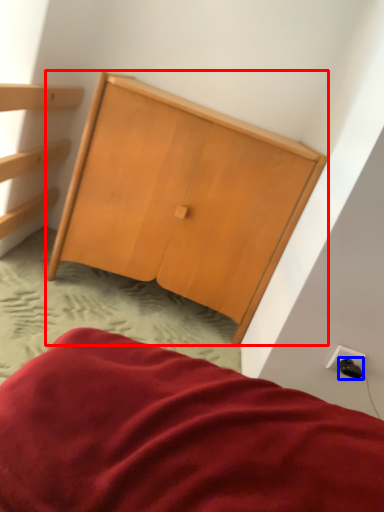
Question: Which object appears farthest to the camera in this image, furniture (highlighted by a red box) or plug (highlighted by a blue box)?

Choices:
 (A) furniture
 (B) plug

Answer: (A)